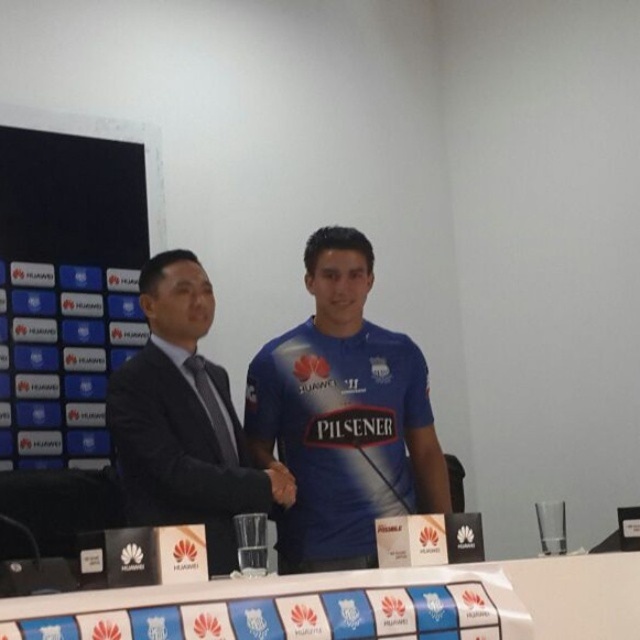
You are attending a press conference and need to place a name tag on the table. If you are facing the dark blue suit at center and the white glossy table at center, which object should you walk towards to place the name tag?

You should walk towards the white glossy table at center because it is closer to you than the dark blue suit at center, as the table is behind the suit.

Based on the photo, you are a photographer at the event and need to position yourself so that both the point at (227, 515) and the point at (129, 604) are in your camera frame. Which point should you focus on first to ensure both are in focus?

You should focus on the point at (227, 515) first because it is closer to the viewer than the point at (129, 604), ensuring both are within the depth of field.

You are standing at the point marked as point [156,321] in the image. You want to reach the door located at the opposite side of the room. The shortest path to the door requires moving 4 meters forward. However, there is an obstacle 1.8 meters in front of you. Can you navigate around it without deviating more than 1 meter to the side?

The point [156,321] is 2.60 meters away from the viewer. Since the obstacle is 1.8 meters in front, you have 2.60 minus 1.8 equals 0.8 meters remaining. To go around, you need at least 1 meter clearance, but only 0.8 meters is available. Therefore, you cannot navigate around the obstacle without deviating more than 1 meter to the side.